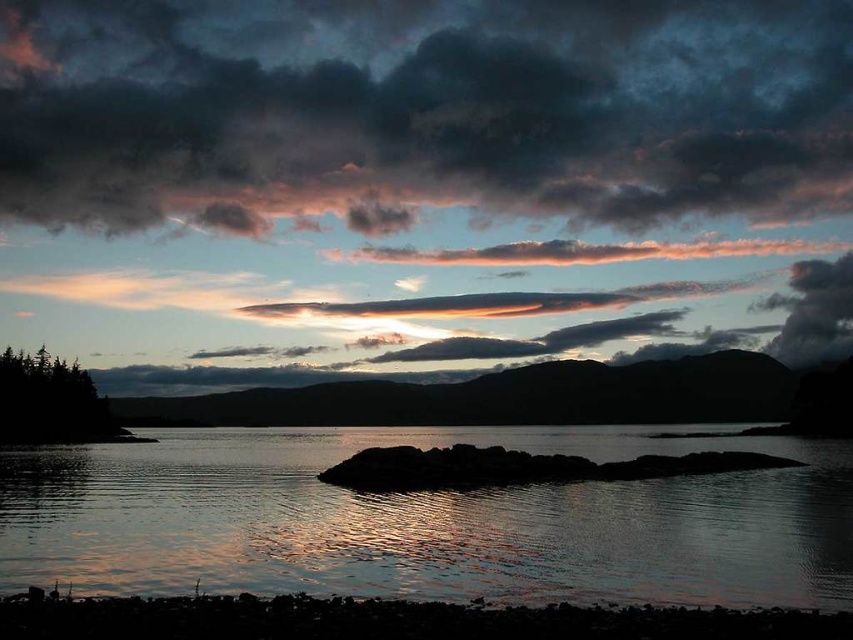
Can you confirm if silvery reflective water at center is shorter than smooth sand shoreline at lower center?

Incorrect, silvery reflective water at center's height does not fall short of smooth sand shoreline at lower center's.

Does silvery reflective water at center appear under smooth sand shoreline at lower center?

Yes, silvery reflective water at center is below smooth sand shoreline at lower center.

Who is more distant from viewer, (747, 518) or (328, 625)?

The point (747, 518) is more distant.

The height and width of the screenshot is (640, 853). Find the location of `silvery reflective water at center`. silvery reflective water at center is located at coordinates (428, 518).

Measure the distance between dark gray cloud at upper center and smooth sand shoreline at lower center.

dark gray cloud at upper center is 384.74 meters from smooth sand shoreline at lower center.

Who is shorter, dark gray cloud at upper center or smooth sand shoreline at lower center?

smooth sand shoreline at lower center

Locate an element on the screen. Image resolution: width=853 pixels, height=640 pixels. dark gray cloud at upper center is located at coordinates (421, 112).

Does silvery reflective water at center have a greater width compared to translucent pink cloud at center?

Yes, silvery reflective water at center is wider than translucent pink cloud at center.

Is silvery reflective water at center thinner than translucent pink cloud at center?

No, silvery reflective water at center is not thinner than translucent pink cloud at center.

Describe the element at coordinates (428, 518) in the screenshot. The width and height of the screenshot is (853, 640). I see `silvery reflective water at center` at that location.

You are a GUI agent. You are given a task and a screenshot of the screen. Output one action in this format:
    pyautogui.click(x=<x>, y=<y>)
    Task: Click on the silvery reflective water at center
    The height and width of the screenshot is (640, 853).
    Given the screenshot: What is the action you would take?
    pos(428,518)